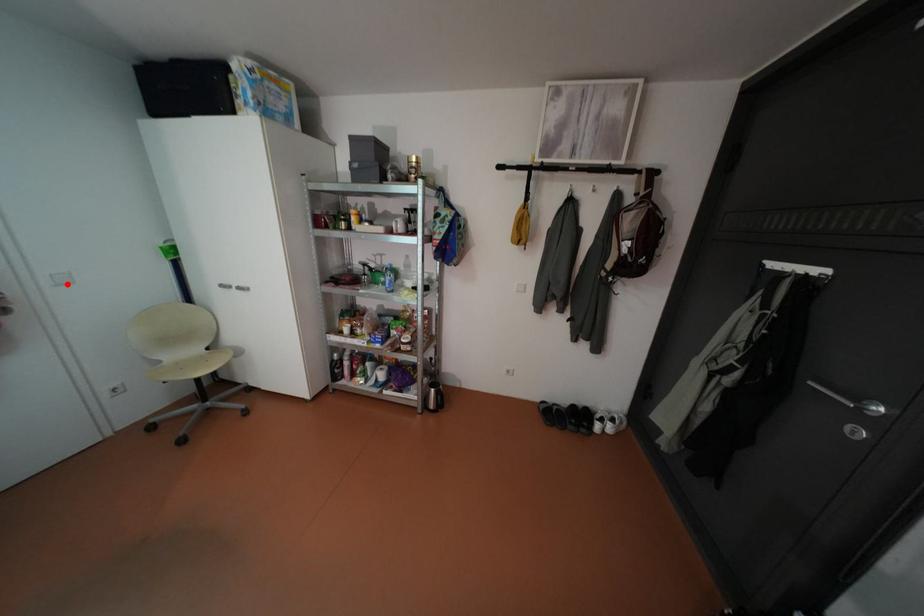
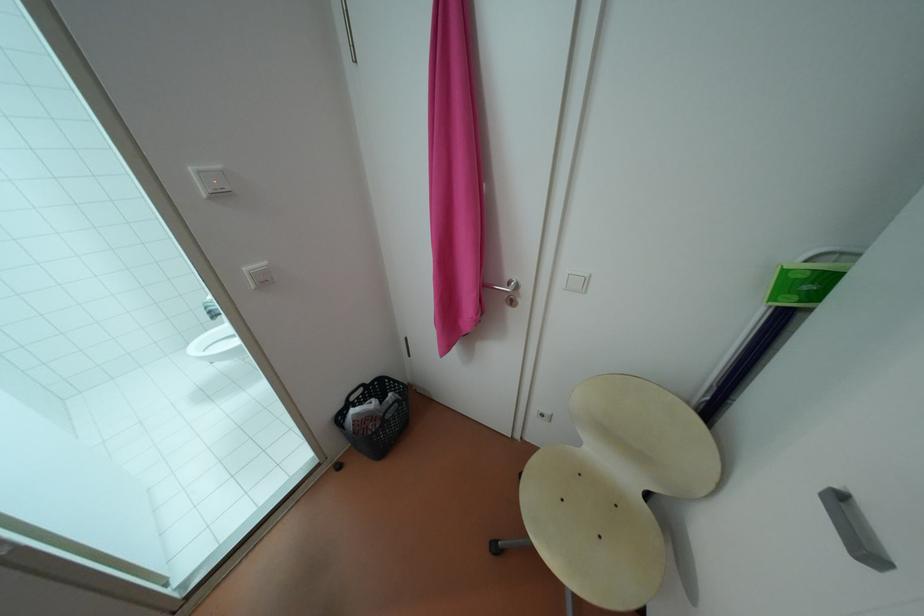
Find the pixel in the second image that matches the highlighted location in the first image.

(576, 288)